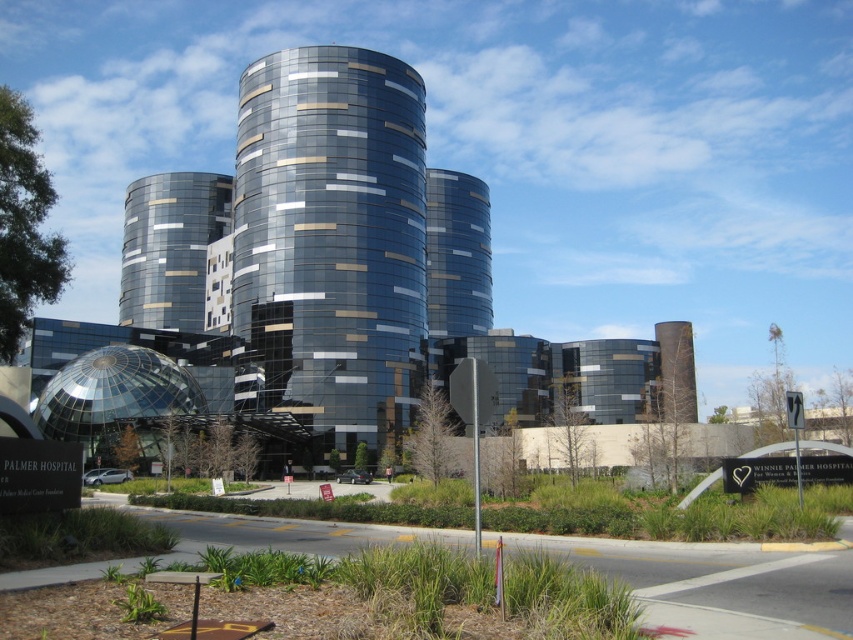
You are an architect planning to install a new sculpture between the glossy glass tower at center and the metallic glass building at center. The sculpture requires a minimum of 30 meters of space between them. Based on the scene, is there enough space for the sculpture?

The distance between the glossy glass tower at center and the metallic glass building at center is 33.79 meters, which is more than the required 30 meters. Therefore, there is sufficient space for the sculpture.

You are an architect evaluating the Palmer Hospital building. You need to determine which of the two central structures, the glossy glass tower at center or the metallic glass building at center, has a narrower width for potential renovation planning. Which one should you consider?

The glossy glass tower at center has a narrower width than the metallic glass building at center, so it should be considered for renovation planning.

Based on the photo, you are a visitor arriving at the Palmer Hospital and see the glossy glass tower at center and the metallic glass building at center. According to the scene, which one is positioned to the right?

The glossy glass tower at center is positioned to the right of the metallic glass building at center.